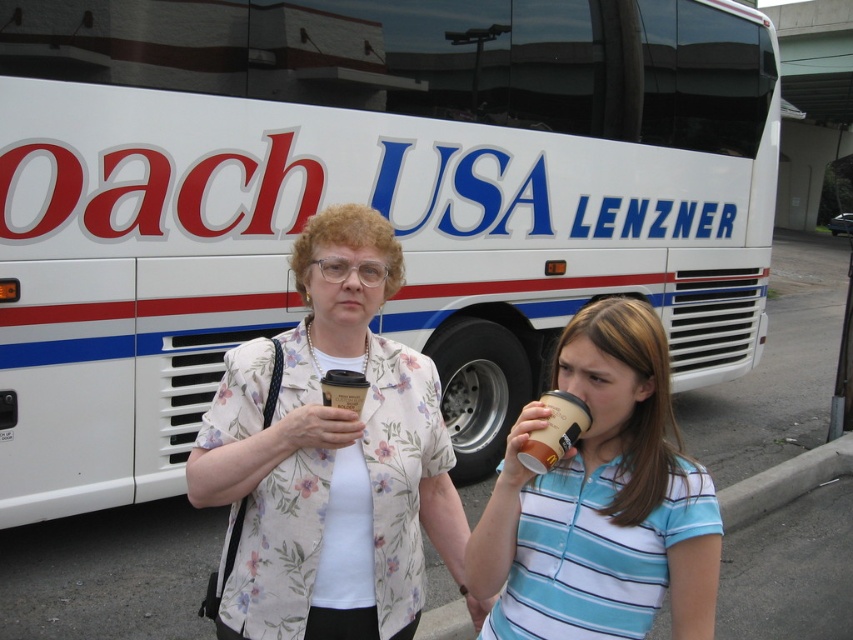
Question: Based on their relative distances, which object is nearer to the brown paper cup at center?

Choices:
 (A) striped cotton shirt at lower right
 (B) floral fabric blouse at center

Answer: (A)

Question: Is floral fabric blouse at center below striped cotton shirt at lower right?

Choices:
 (A) yes
 (B) no

Answer: (B)

Question: Considering the real-world distances, which object is closest to the brown paper cup at center?

Choices:
 (A) striped cotton shirt at lower right
 (B) floral fabric blouse at center

Answer: (A)

Question: Can you confirm if floral fabric blouse at center is wider than striped cotton shirt at lower right?

Choices:
 (A) yes
 (B) no

Answer: (A)

Question: Considering the real-world distances, which object is farthest from the brown paper cup at center?

Choices:
 (A) striped cotton shirt at lower right
 (B) floral fabric blouse at center

Answer: (B)

Question: Does floral fabric blouse at center come behind brown paper cup at center?

Choices:
 (A) yes
 (B) no

Answer: (A)